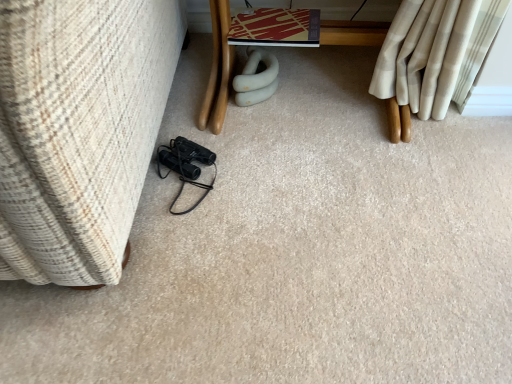
You are a GUI agent. You are given a task and a screenshot of the screen. Output one action in this format:
    pyautogui.click(x=<x>, y=<y>)
    Task: Click on the vacant space in front of wooden table at center
    
    Given the screenshot: What is the action you would take?
    pos(326,227)